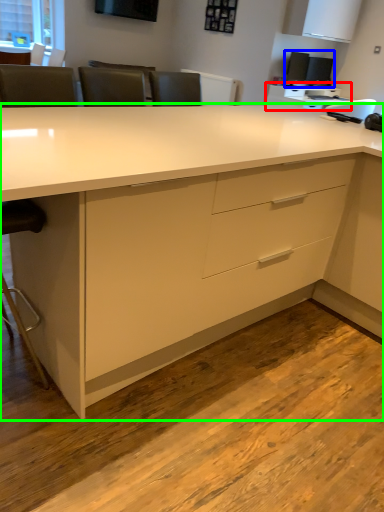
Question: Estimate the real-world distances between objects in this image. Which object is farther from computer desk (highlighted by a red box), desktop computer (highlighted by a blue box) or desk (highlighted by a green box)?

Choices:
 (A) desktop computer
 (B) desk

Answer: (B)